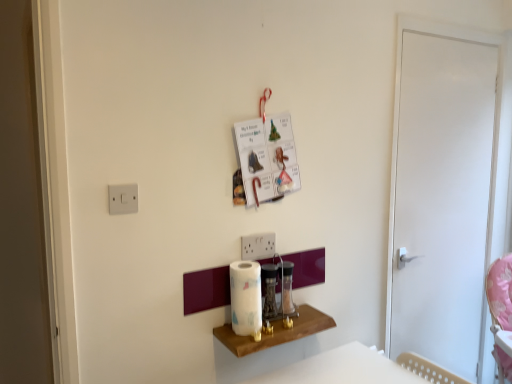
I want to click on free space on the front side of metallic silver blender at center, placed as the 2th appliance when sorted from right to left, so click(x=265, y=333).